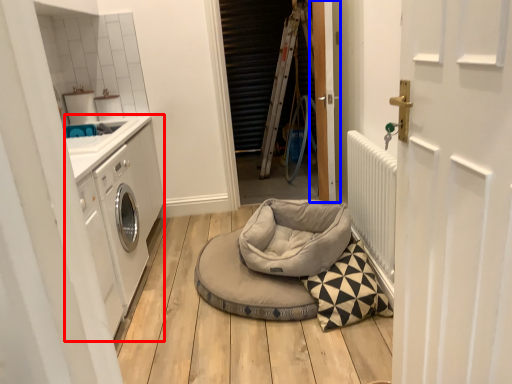
Question: Which point is closer to the camera, washing machine (highlighted by a red box) or door (highlighted by a blue box)?

Choices:
 (A) washing machine
 (B) door

Answer: (B)